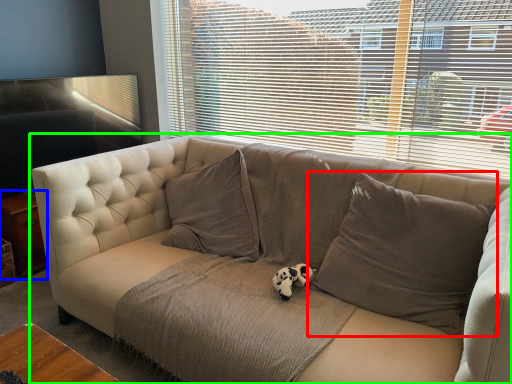
Question: Considering the real-world distances, which object is farthest from pillow (highlighted by a red box)? table (highlighted by a blue box) or studio couch (highlighted by a green box)?

Choices:
 (A) table
 (B) studio couch

Answer: (A)